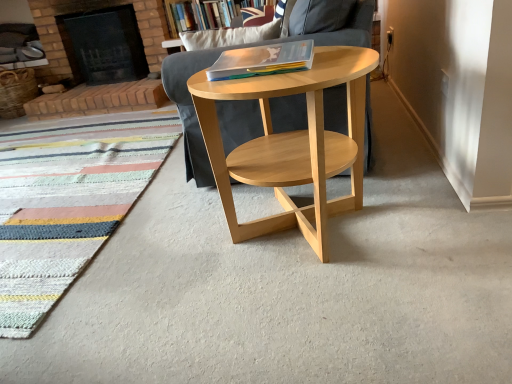
Question: Can you confirm if multicolored woven mat at lower left is positioned to the right of translucent plastic folder at center?

Choices:
 (A) yes
 (B) no

Answer: (B)

Question: From the image's perspective, would you say multicolored woven mat at lower left is positioned over translucent plastic folder at center?

Choices:
 (A) yes
 (B) no

Answer: (B)

Question: Is the surface of multicolored woven mat at lower left in direct contact with translucent plastic folder at center?

Choices:
 (A) no
 (B) yes

Answer: (A)

Question: Is multicolored woven mat at lower left closer to the viewer compared to translucent plastic folder at center?

Choices:
 (A) yes
 (B) no

Answer: (B)

Question: Is multicolored woven mat at lower left outside of translucent plastic folder at center?

Choices:
 (A) yes
 (B) no

Answer: (A)

Question: Does multicolored woven mat at lower left appear on the left side of translucent plastic folder at center?

Choices:
 (A) no
 (B) yes

Answer: (B)

Question: Is natural wood chair at center wider than translucent plastic folder at center?

Choices:
 (A) no
 (B) yes

Answer: (B)

Question: From a real-world perspective, is natural wood chair at center positioned over translucent plastic folder at center based on gravity?

Choices:
 (A) yes
 (B) no

Answer: (B)

Question: Can you confirm if natural wood chair at center is smaller than translucent plastic folder at center?

Choices:
 (A) yes
 (B) no

Answer: (B)

Question: Is natural wood chair at center turned away from translucent plastic folder at center?

Choices:
 (A) no
 (B) yes

Answer: (A)

Question: Can you confirm if natural wood chair at center is shorter than translucent plastic folder at center?

Choices:
 (A) no
 (B) yes

Answer: (A)

Question: Is translucent plastic folder at center a part of natural wood chair at center?

Choices:
 (A) no
 (B) yes

Answer: (A)

Question: Considering the relative positions of wooden bookshelf at upper center and natural wood chair at center in the image provided, is wooden bookshelf at upper center to the right of natural wood chair at center from the viewer's perspective?

Choices:
 (A) no
 (B) yes

Answer: (A)